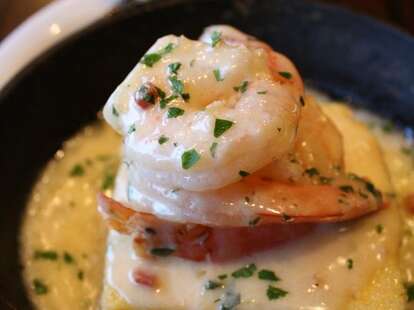
Locate an element on the screen. Image resolution: width=414 pixels, height=310 pixels. plate is located at coordinates (59, 21).